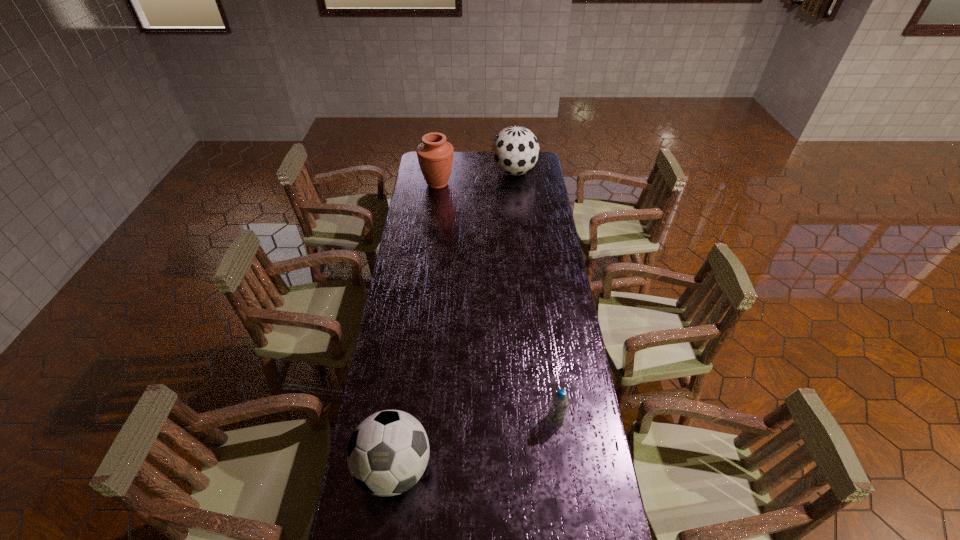
Identify the location of object present at the far edge. This screenshot has height=540, width=960. (515, 150).

This screenshot has height=540, width=960. In order to click on vase positioned at the left edge in this screenshot , I will do `click(435, 155)`.

The height and width of the screenshot is (540, 960). In order to click on soccer ball that is at the left edge in this screenshot , I will do `click(387, 454)`.

Locate an element on the screen. soccer ball that is at the right edge is located at coordinates (515, 150).

Image resolution: width=960 pixels, height=540 pixels. What are the coordinates of `water bottle at the right edge` in the screenshot? It's located at (560, 401).

Where is `object located in the far right corner section of the desktop`? The height and width of the screenshot is (540, 960). object located in the far right corner section of the desktop is located at coordinates (515, 150).

Find the location of a particular element. This screenshot has height=540, width=960. vacant region at the left edge is located at coordinates (404, 248).

In the image, there is a desktop. Where is `vacant space at the right edge`? The image size is (960, 540). vacant space at the right edge is located at coordinates (556, 347).

In order to click on free point between the shortest object and the shorter soccer ball in this screenshot , I will do `click(475, 443)`.

The width and height of the screenshot is (960, 540). In order to click on vacant space that is in between the nearer soccer ball and the right soccer ball in this screenshot , I will do `click(454, 320)`.